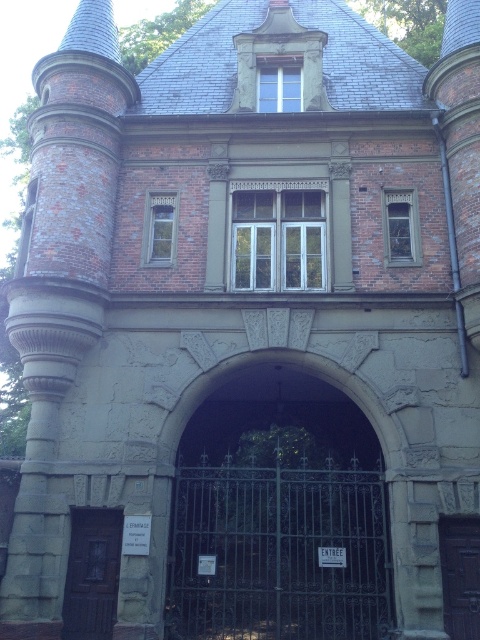
You are a delivery person with a large package that requires a 1.2 meter wide opening. You see the dark gray wrought iron gate at center and the dark brown wooden door at center. Which one can you use to enter?

The dark gray wrought iron gate at center might be wider than dark brown wooden door at center, so it is possible that the gate can accommodate the 1.2 meter requirement, while the door may be too narrow.

Based on the photo, you are a visitor approaching the entrance of the historic building. You see the brown wooden door at lower left and the dark brown wooden door at center. Which door is positioned to the left when facing the building?

The brown wooden door at lower left is positioned to the left of the dark brown wooden door at center when facing the building.

You are a visitor approaching the entrance of the historic building. You see the brown wooden door at lower left and the dark brown wooden door at center. Which door is located lower in position?

The brown wooden door at lower left is positioned under the dark brown wooden door at center, so it is located lower.